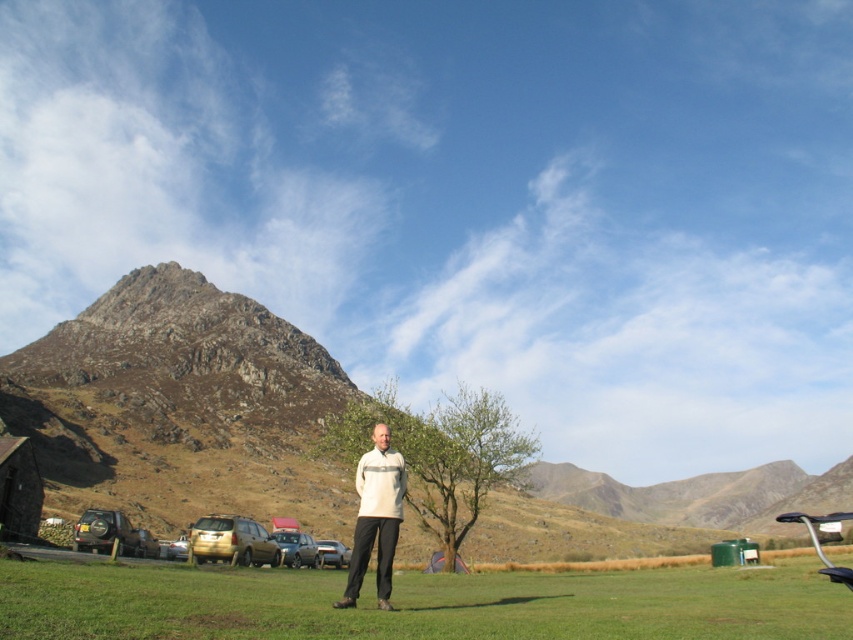
You are planning to set up a tent in this scene. The rugged stone mountain at center and the green grass at lower center are both visible from where you are standing. Which area would you choose to set up your tent and why?

You should choose the green grass at lower center to set up your tent because the rugged stone mountain at center is wider, making it less suitable for tent setup.

You are a photographer planning to capture a landscape shot that includes both the rugged stone mountain at center and the light beige sweater at center. Which object should you position closer to the edge of the frame to ensure both fit within the shot?

Since the rugged stone mountain at center is wider than the light beige sweater at center, you should position the rugged stone mountain at center closer to the edge of the frame to ensure both fit within the shot.